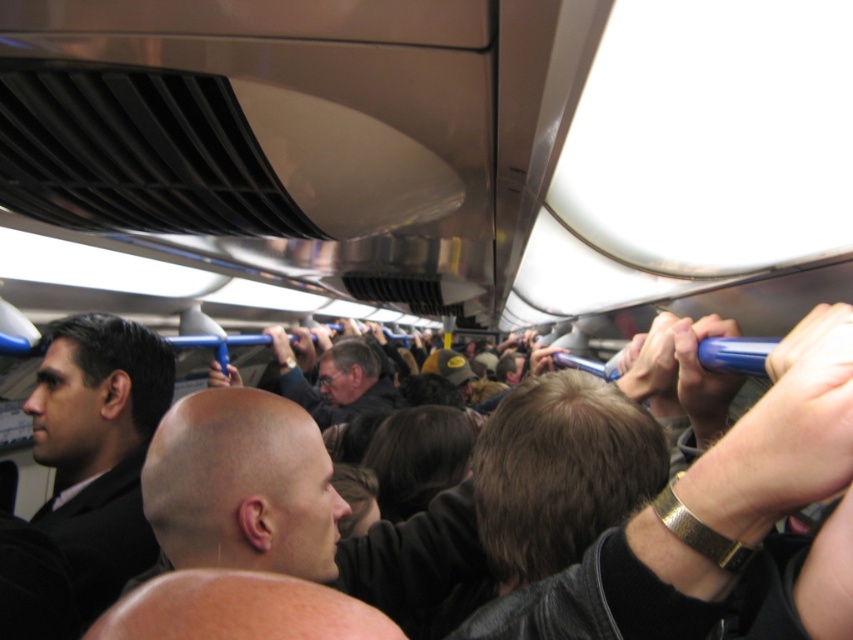
Question: Does bald head at center appear over dark brown suit at left?

Choices:
 (A) yes
 (B) no

Answer: (A)

Question: Which point appears farthest from the camera in this image?

Choices:
 (A) (358, 401)
 (B) (84, 520)
 (C) (273, 480)

Answer: (A)

Question: Which of the following is the closest to the observer?

Choices:
 (A) dark brown suit at left
 (B) dark gray sweater at center

Answer: (A)

Question: Which of these objects is positioned closest to the dark brown suit at left?

Choices:
 (A) bald head at center
 (B) dark gray sweater at center

Answer: (A)

Question: Can you confirm if bald head at center is smaller than dark gray sweater at center?

Choices:
 (A) no
 (B) yes

Answer: (B)

Question: Does bald head at center appear on the left side of dark gray sweater at center?

Choices:
 (A) yes
 (B) no

Answer: (B)